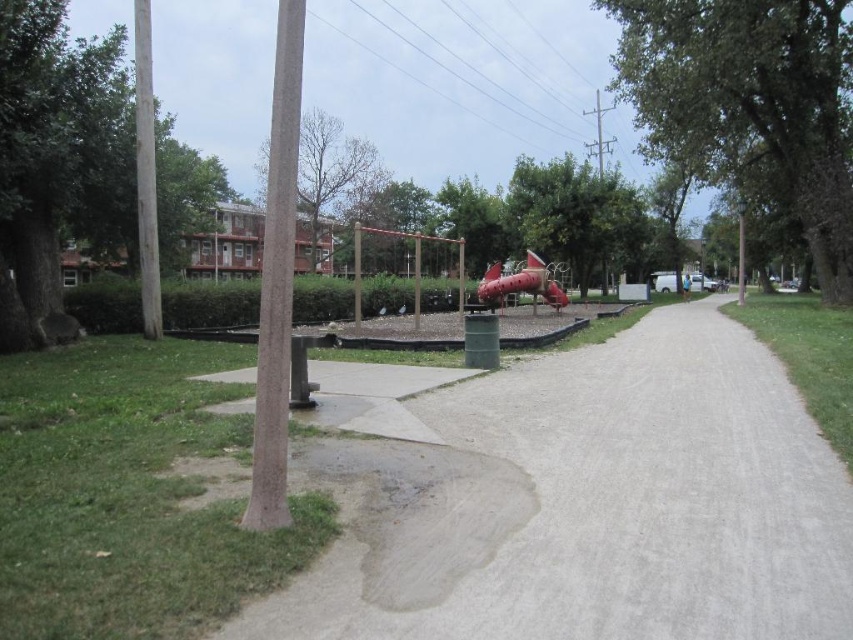
Can you confirm if green rough bark tree at left is thinner than smooth red slide at center?

In fact, green rough bark tree at left might be wider than smooth red slide at center.

Which is more to the right, green rough bark tree at left or smooth red slide at center?

smooth red slide at center is more to the right.

Is point (125, 134) closer to camera compared to point (534, 291)?

Yes, point (125, 134) is in front of point (534, 291).

Where is `green rough bark tree at left`? green rough bark tree at left is located at coordinates (57, 161).

Between green leafy tree at right and metallic red slide at center, which one has less height?

Standing shorter between the two is metallic red slide at center.

The width and height of the screenshot is (853, 640). What do you see at coordinates (752, 106) in the screenshot? I see `green leafy tree at right` at bounding box center [752, 106].

Find the location of a particular element. green leafy tree at right is located at coordinates (752, 106).

Where is `green leafy tree at right`? The width and height of the screenshot is (853, 640). green leafy tree at right is located at coordinates pyautogui.click(x=752, y=106).

Which of these two, green leafy tree at right or bare wood tree at upper center, stands shorter?

bare wood tree at upper center is shorter.

Find the location of a particular element. green leafy tree at right is located at coordinates (752, 106).

The width and height of the screenshot is (853, 640). I want to click on green leafy tree at right, so click(x=752, y=106).